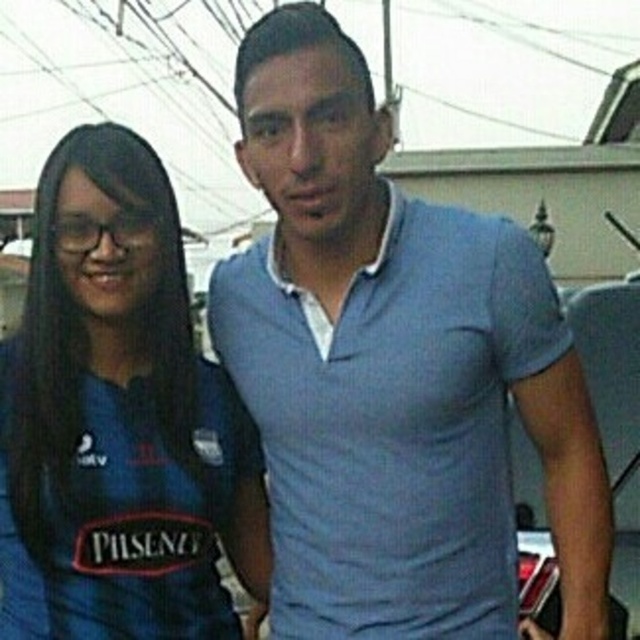
You are a photographer setting up a shot of two people under a canopy. The matte blue polo shirt at center and the blue fabric shirt at left are part of the scene. Based on their heights, which person should stand closer to the camera to avoid one blocking the other?

The matte blue polo shirt at center is much taller than the blue fabric shirt at left, so the shorter blue fabric shirt at left should stand closer to the camera to prevent the taller person from blocking them.

You are organizing a photo shoot and need to arrange two models wearing the matte blue polo shirt at center and the blue fabric shirt at left. Based on the scene, which model should stand to the right side of the other?

The matte blue polo shirt at center should stand to the right side of the blue fabric shirt at left because the matte blue polo shirt at center is positioned on the right side of blue fabric shirt at left.